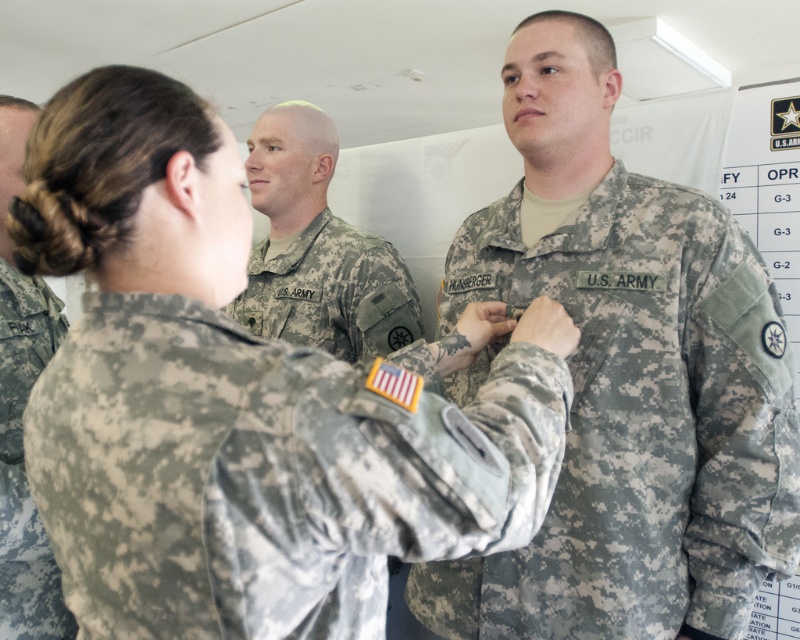
The image size is (800, 640). What do you see at coordinates (268, 474) in the screenshot?
I see `camouflage fabric at center` at bounding box center [268, 474].

Does camouflage fabric at center have a smaller size compared to camouflage uniform at center?

No, camouflage fabric at center is not smaller than camouflage uniform at center.

Where is `camouflage fabric at center`? This screenshot has height=640, width=800. camouflage fabric at center is located at coordinates (268, 474).

This screenshot has width=800, height=640. What are the coordinates of `camouflage fabric at center` in the screenshot? It's located at (268, 474).

Can you confirm if camouflage fabric us army uniform at center is shorter than camouflage uniform at center?

Yes, camouflage fabric us army uniform at center is shorter than camouflage uniform at center.

I want to click on camouflage fabric us army uniform at center, so click(x=637, y=422).

Locate an element on the screen. camouflage fabric us army uniform at center is located at coordinates (637, 422).

Does camouflage fabric at center have a lesser width compared to camouflage fabric us army uniform at center?

No, camouflage fabric at center is not thinner than camouflage fabric us army uniform at center.

Who is more forward, [314,552] or [570,244]?

Point [314,552]

In order to click on camouflage fabric at center in this screenshot , I will do `click(268, 474)`.